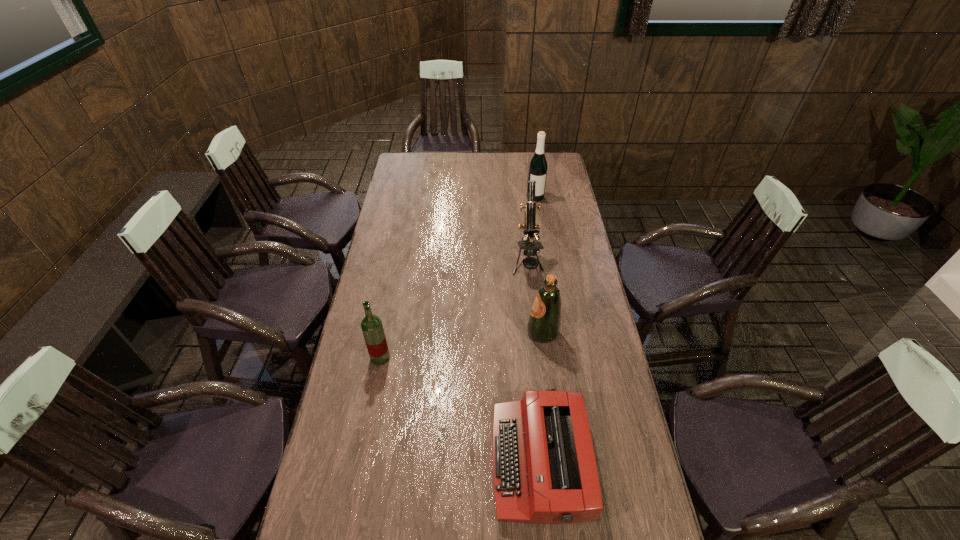
Locate an element on the screen. The image size is (960, 540). free space at the left edge of the desktop is located at coordinates (416, 189).

Identify the location of free space at the right edge of the desktop. (577, 349).

The image size is (960, 540). In order to click on vacant region at the far left corner of the desktop in this screenshot , I will do `click(422, 161)`.

Locate an element on the screen. The width and height of the screenshot is (960, 540). free point between the microscope and the leftmost object is located at coordinates (454, 310).

In order to click on vacant space that's between the fourth nearest object and the nearest object in this screenshot , I will do `click(534, 362)`.

This screenshot has height=540, width=960. I want to click on object that ranks as the closest to the leftmost object, so click(x=544, y=469).

In order to click on the third closest object to the fourth nearest object in this screenshot , I will do `click(544, 469)`.

Locate an element on the screen. The width and height of the screenshot is (960, 540). free spot that satisfies the following two spatial constraints: 1. through the eyepiece of the fourth nearest object; 2. on the typing side of the typewriter is located at coordinates (549, 462).

Find the location of `vacant space that satisfies the following two spatial constraints: 1. on the label of the farthest object; 2. on the typing side of the nearest object`. vacant space that satisfies the following two spatial constraints: 1. on the label of the farthest object; 2. on the typing side of the nearest object is located at coordinates (576, 462).

You are a GUI agent. You are given a task and a screenshot of the screen. Output one action in this format:
    pyautogui.click(x=<x>, y=<y>)
    Task: Click on the vacant space that satisfies the following two spatial constraints: 1. through the eyepiece of the microscope; 2. on the typing side of the typewriter
    
    Given the screenshot: What is the action you would take?
    pyautogui.click(x=549, y=462)